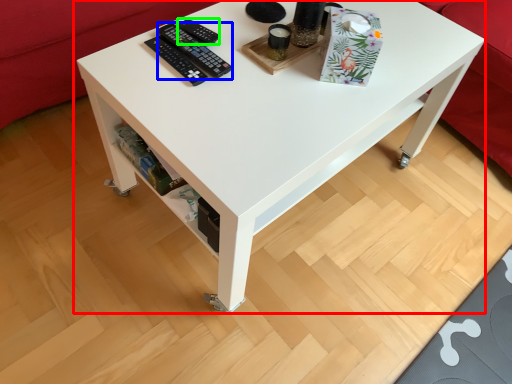
Question: Which is nearer to the table (highlighted by a red box)? control (highlighted by a blue box) or control (highlighted by a green box).

Choices:
 (A) control
 (B) control

Answer: (A)